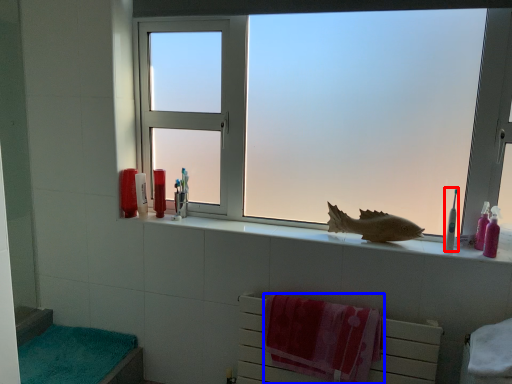
Question: Which object is further to the camera taking this photo, toothbrush (highlighted by a red box) or beach towel (highlighted by a blue box)?

Choices:
 (A) toothbrush
 (B) beach towel

Answer: (A)